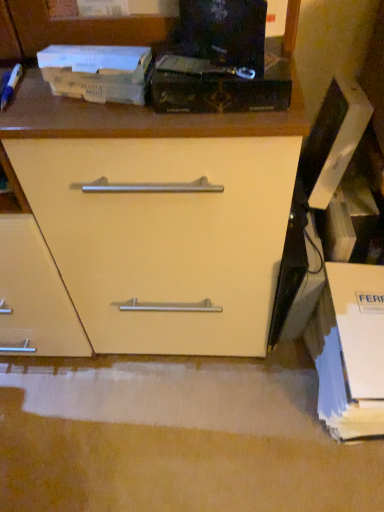
Question: Looking at the image, does brown cardboard book at upper left, placed as the first paperback book when sorted from left to right, seem bigger or smaller compared to white cardboard box at lower right?

Choices:
 (A) small
 (B) big

Answer: (A)

Question: From the image's perspective, is brown cardboard book at upper left, arranged as the 2th paperback book when viewed from the right, positioned above or below white cardboard box at lower right?

Choices:
 (A) above
 (B) below

Answer: (A)

Question: Which object is positioned closest to the brown cardboard book at upper left, placed as the first paperback book when sorted from left to right?

Choices:
 (A) black matte paperback book at upper center, marked as the 2th paperback book in a left-to-right arrangement
 (B) white cardboard box at lower right

Answer: (A)

Question: Considering the real-world distances, which object is closest to the black matte paperback book at upper center, marked as the 2th paperback book in a left-to-right arrangement?

Choices:
 (A) brown cardboard book at upper left, arranged as the 2th paperback book when viewed from the right
 (B) white cardboard box at lower right

Answer: (A)